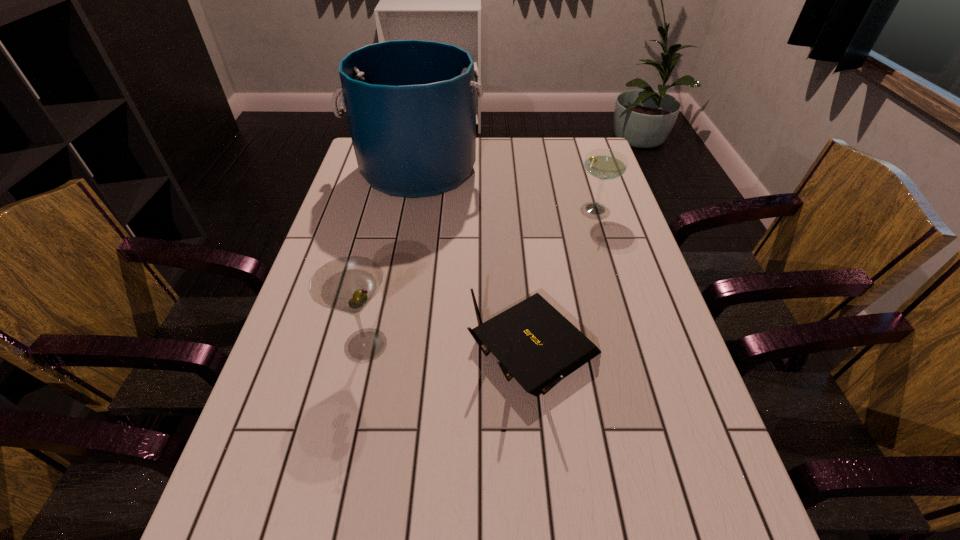
Locate an element on the screen. The height and width of the screenshot is (540, 960). vacant region between the farther martini and the bucket is located at coordinates (506, 190).

This screenshot has width=960, height=540. What are the coordinates of `free space between the router and the nearer martini` in the screenshot? It's located at (450, 347).

Locate an element on the screen. This screenshot has width=960, height=540. vacant area that lies between the shorter martini and the router is located at coordinates (564, 279).

The height and width of the screenshot is (540, 960). What are the coordinates of `empty location between the bucket and the taller martini` in the screenshot? It's located at (392, 258).

Find the location of a particular element. free spot between the left martini and the bucket is located at coordinates (392, 258).

Find the location of a particular element. Image resolution: width=960 pixels, height=540 pixels. empty space that is in between the tallest object and the third shortest object is located at coordinates (392, 258).

Locate an element on the screen. Image resolution: width=960 pixels, height=540 pixels. free area in between the nearer martini and the farther martini is located at coordinates (480, 277).

The width and height of the screenshot is (960, 540). I want to click on free space between the router and the farther martini, so click(564, 279).

Point out which object is positioned as the third nearest to the shortest object. Please provide its 2D coordinates. Your answer should be formatted as a tuple, i.e. [(x, y)], where the tuple contains the x and y coordinates of a point satisfying the conditions above.

[(410, 104)]

Image resolution: width=960 pixels, height=540 pixels. I want to click on object identified as the third closest to the tallest object, so click(347, 284).